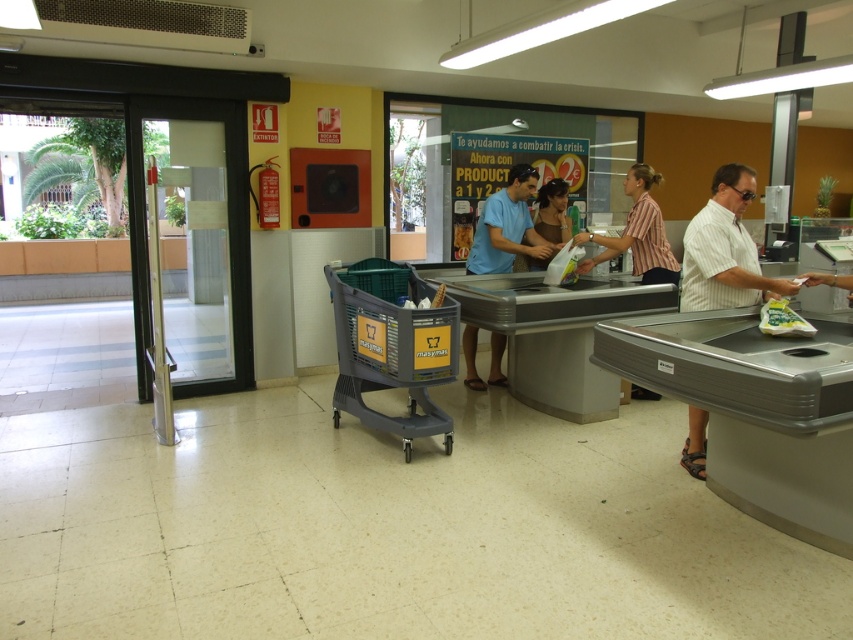
Does point (714, 298) come behind point (502, 252)?

That is False.

Who is more distant from viewer, (x=701, y=464) or (x=495, y=384)?

Point (x=495, y=384)

Find the location of a particular element. white striped shirt at right is located at coordinates (724, 250).

From the picture: Is white striped shirt at right in front of striped cotton shirt at center?

Yes, it is in front of striped cotton shirt at center.

Who is positioned more to the left, white striped shirt at right or striped cotton shirt at center?

striped cotton shirt at center is more to the left.

Is point (695, 307) closer to camera compared to point (633, 264)?

Yes, point (695, 307) is closer to viewer.

Find the location of a particular element. white striped shirt at right is located at coordinates (724, 250).

Which is more to the left, blue cotton shirt at center or striped cotton shirt at center?

From the viewer's perspective, blue cotton shirt at center appears more on the left side.

Can you confirm if blue cotton shirt at center is bigger than striped cotton shirt at center?

No, blue cotton shirt at center is not bigger than striped cotton shirt at center.

Find the location of a particular element. The image size is (853, 640). blue cotton shirt at center is located at coordinates (508, 227).

What are the coordinates of `blue cotton shirt at center` in the screenshot? It's located at (508, 227).